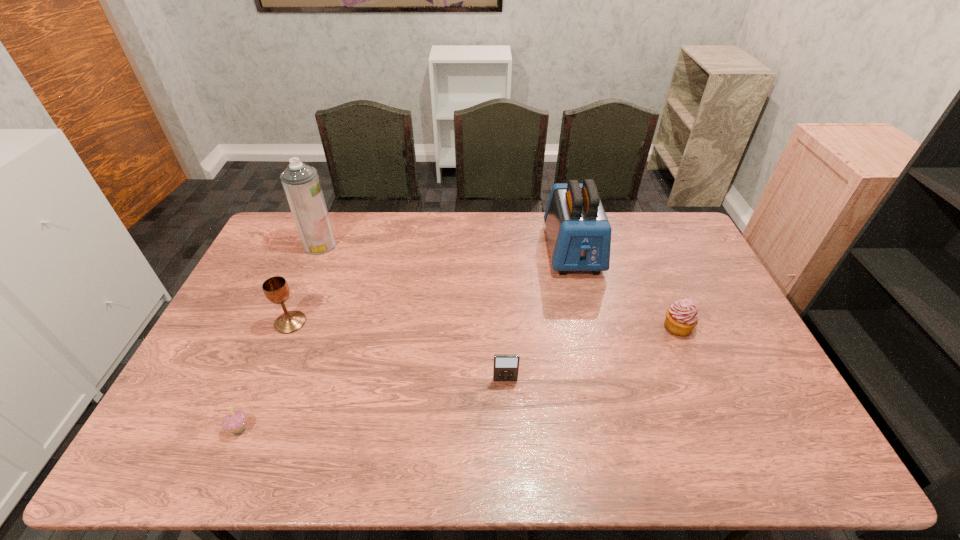
Locate an element on the screen. blank area located on the back of the tallest object is located at coordinates (332, 215).

The height and width of the screenshot is (540, 960). Identify the location of free spot located on the front-facing side of the toaster. (590, 323).

Locate an element on the screen. This screenshot has height=540, width=960. free space located on the left of the fourth shortest object is located at coordinates (243, 322).

Locate an element on the screen. The image size is (960, 540). free space located 0.150m on the right of the right cupcake is located at coordinates (742, 327).

Locate an element on the screen. vacant space located on the front-facing side of the second nearest object is located at coordinates (510, 467).

Where is `vacant space located on the right of the shortest object`? vacant space located on the right of the shortest object is located at coordinates (324, 428).

Find the location of a particular element. aerosol can that is at the far edge is located at coordinates (301, 183).

Locate an element on the screen. toaster at the far edge is located at coordinates (579, 234).

This screenshot has width=960, height=540. I want to click on object at the near edge, so click(x=235, y=422).

Identify the location of aerosol can that is at the left edge. (301, 183).